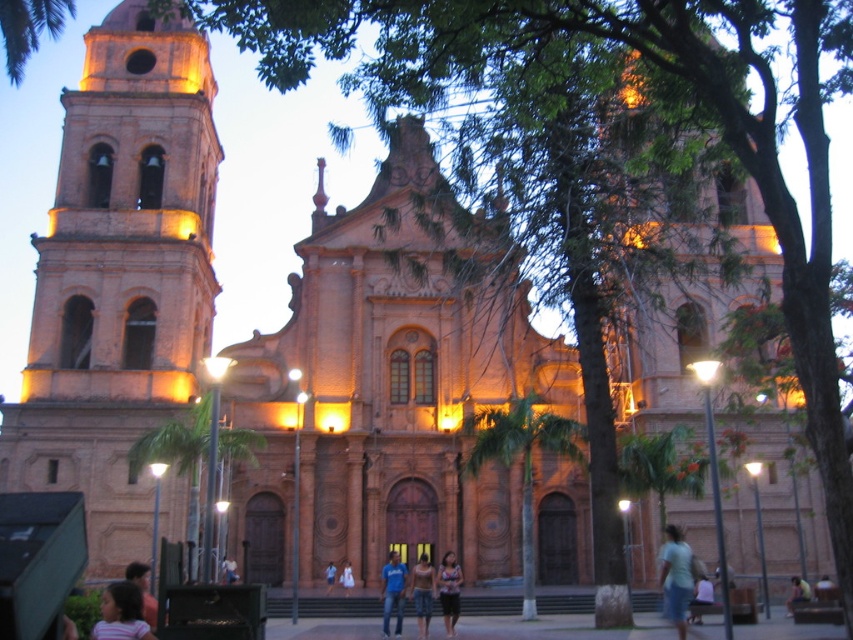
Question: Is light blue jeans at center in front of light blue denim shorts at center?

Choices:
 (A) yes
 (B) no

Answer: (B)

Question: Which object is farther from the camera taking this photo?

Choices:
 (A) light brown leather jacket at lower right
 (B) matte orange bell tower at left

Answer: (A)

Question: Does light blue denim shorts at lower center appear on the right side of light blue denim shorts at lower right?

Choices:
 (A) yes
 (B) no

Answer: (B)

Question: Which point appears farthest from the camera in this image?

Choices:
 (A) (701, 600)
 (B) (222, 572)

Answer: (A)

Question: Can you confirm if matte orange bell tower at left is positioned below blue cotton shirt at center?

Choices:
 (A) no
 (B) yes

Answer: (A)

Question: Which of the following is the farthest from the observer?

Choices:
 (A) (706, 596)
 (B) (396, 589)
 (C) (144, 616)

Answer: (A)